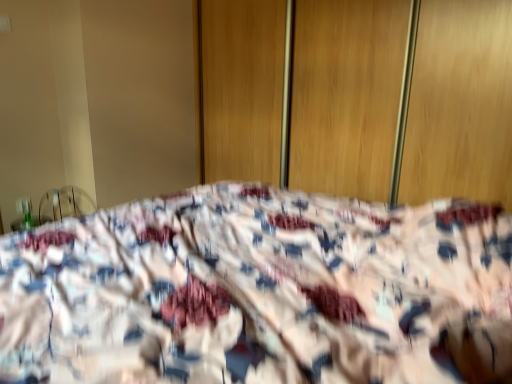
Question: Is wooden screen door at center further to the viewer compared to fluffy fabric bed at center?

Choices:
 (A) no
 (B) yes

Answer: (B)

Question: Can you confirm if wooden screen door at center is shorter than fluffy fabric bed at center?

Choices:
 (A) yes
 (B) no

Answer: (B)

Question: Does wooden screen door at center have a greater width compared to fluffy fabric bed at center?

Choices:
 (A) no
 (B) yes

Answer: (A)

Question: Does wooden screen door at center lie in front of fluffy fabric bed at center?

Choices:
 (A) no
 (B) yes

Answer: (A)

Question: Is wooden screen door at center at the left side of fluffy fabric bed at center?

Choices:
 (A) no
 (B) yes

Answer: (A)

Question: From the image's perspective, is wooden screen door at center located beneath fluffy fabric bed at center?

Choices:
 (A) no
 (B) yes

Answer: (A)

Question: From the image's perspective, is fluffy fabric bed at center below wooden screen door at center?

Choices:
 (A) no
 (B) yes

Answer: (B)

Question: Is fluffy fabric bed at center to the right of wooden screen door at center from the viewer's perspective?

Choices:
 (A) no
 (B) yes

Answer: (A)

Question: Could you tell me if fluffy fabric bed at center is turned towards wooden screen door at center?

Choices:
 (A) yes
 (B) no

Answer: (B)

Question: Could wooden screen door at center be considered to be inside fluffy fabric bed at center?

Choices:
 (A) no
 (B) yes

Answer: (A)

Question: Does fluffy fabric bed at center come behind wooden screen door at center?

Choices:
 (A) yes
 (B) no

Answer: (B)

Question: From the image's perspective, does fluffy fabric bed at center appear higher than wooden screen door at center?

Choices:
 (A) yes
 (B) no

Answer: (B)

Question: Would you say fluffy fabric bed at center is inside or outside wooden screen door at center?

Choices:
 (A) outside
 (B) inside

Answer: (A)